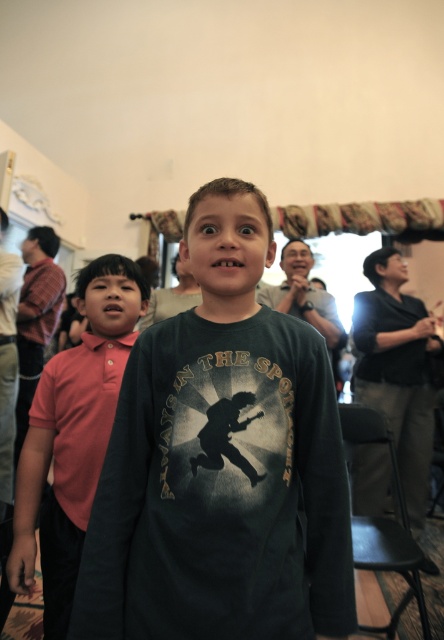
Between dark green long-sleeve shirt at center and red cotton polo shirt at left, which one appears on the left side from the viewer's perspective?

red cotton polo shirt at left

Between dark green long-sleeve shirt at center and red cotton polo shirt at left, which one is positioned higher?

dark green long-sleeve shirt at center is higher up.

Does point (83, 561) come behind point (99, 429)?

No, (83, 561) is closer to viewer.

In order to click on dark green long-sleeve shirt at center in this screenshot , I will do `click(222, 461)`.

Does pink cotton polo shirt at left appear on the left side of red cotton polo shirt at left?

Correct, you'll find pink cotton polo shirt at left to the left of red cotton polo shirt at left.

Who is shorter, pink cotton polo shirt at left or red cotton polo shirt at left?

Standing shorter between the two is red cotton polo shirt at left.

This screenshot has height=640, width=444. What do you see at coordinates (72, 435) in the screenshot?
I see `pink cotton polo shirt at left` at bounding box center [72, 435].

The height and width of the screenshot is (640, 444). I want to click on pink cotton polo shirt at left, so click(x=72, y=435).

Between point (177, 513) and point (114, 262), which one is positioned behind?

Point (114, 262)

Locate an element on the screen. dark green long-sleeve shirt at center is located at coordinates (222, 461).